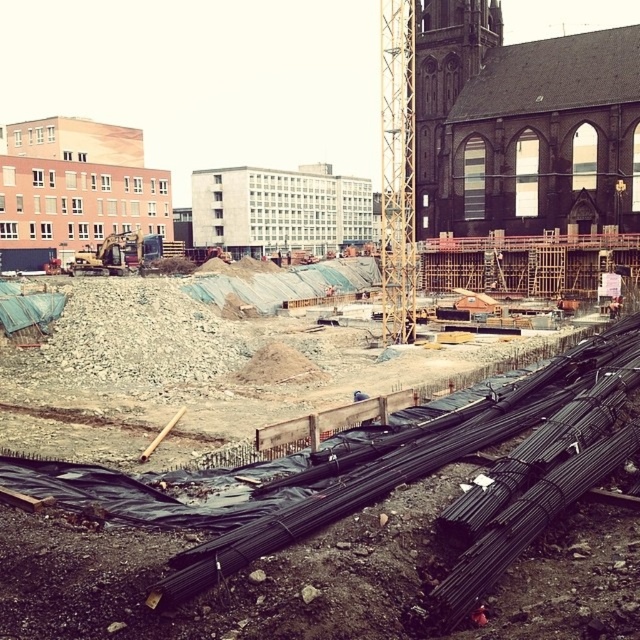
You are a construction worker standing at the edge of the construction site. You need to move the black metal rebar at lower center to the storage area located behind the white concrete building at center. Based on their positions, can you directly walk straight from the rebar to the storage area without going around the building?

The black metal rebar at lower center is below the white concrete building at center, so you cannot walk straight to the storage area behind the building without going around it.

You are a construction worker standing at point (228,579). You need to move to the yellow crane in the center right. Is there any black metal rebar at lower center blocking your path?

The point (228,579) is where the black metal rebar at lower center is located, so moving towards the yellow crane in the center right from that point would require navigating around the rebar as it is directly at your starting position.

You are an architect inspecting a construction site. You notice the dark brown stone church at upper right and the wooden scaffolding at upper center. Which structure is located higher up in the image?

The wooden scaffolding at upper center is positioned above the dark brown stone church at upper right, so the wooden scaffolding at upper center is higher up in the image.